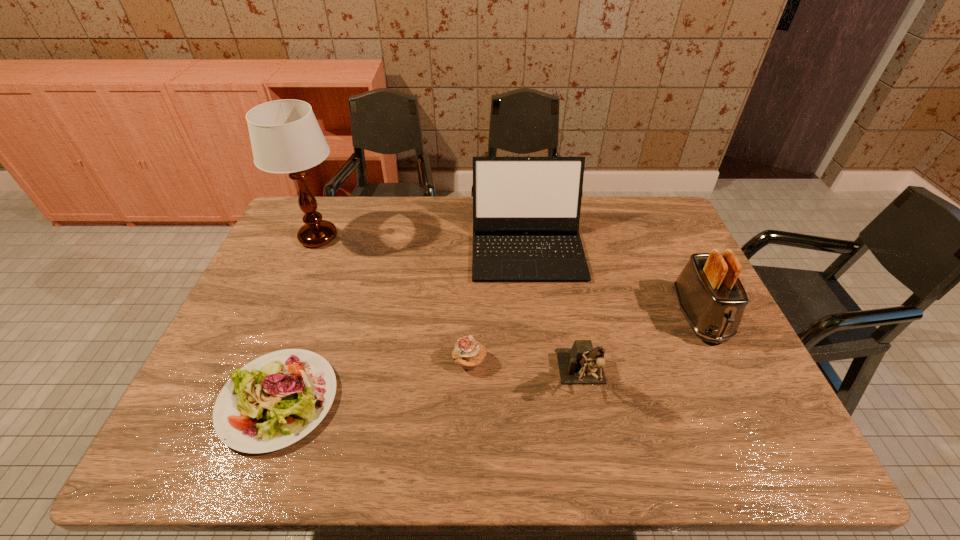
At what (x,y) coordinates should I click in order to perform the action: click on table lamp. Please return your answer as a coordinate pair (x, y). Looking at the image, I should click on (285, 136).

In order to click on laptop in this screenshot , I will do `click(526, 210)`.

I want to click on the rightmost object, so click(712, 298).

Find the location of `figurine`. figurine is located at coordinates (582, 364).

You are a GUI agent. You are given a task and a screenshot of the screen. Output one action in this format:
    pyautogui.click(x=<x>, y=<y>)
    Task: Click on the second shortest object
    Image resolution: width=960 pixels, height=540 pixels.
    Given the screenshot: What is the action you would take?
    (469, 354)

Locate an element on the screen. the shortest object is located at coordinates tap(275, 400).

Where is `vacant space located 0.210m on the front of the table lamp`? This screenshot has height=540, width=960. vacant space located 0.210m on the front of the table lamp is located at coordinates (289, 308).

Find the location of a particular element. vacant space located on the surface of the laptop is located at coordinates (545, 402).

Find the location of `blank space located on the side of the toaster with the control lever`. blank space located on the side of the toaster with the control lever is located at coordinates (756, 435).

The height and width of the screenshot is (540, 960). What are the coordinates of `free space located 0.090m on the front-facing side of the figurine` in the screenshot? It's located at (596, 448).